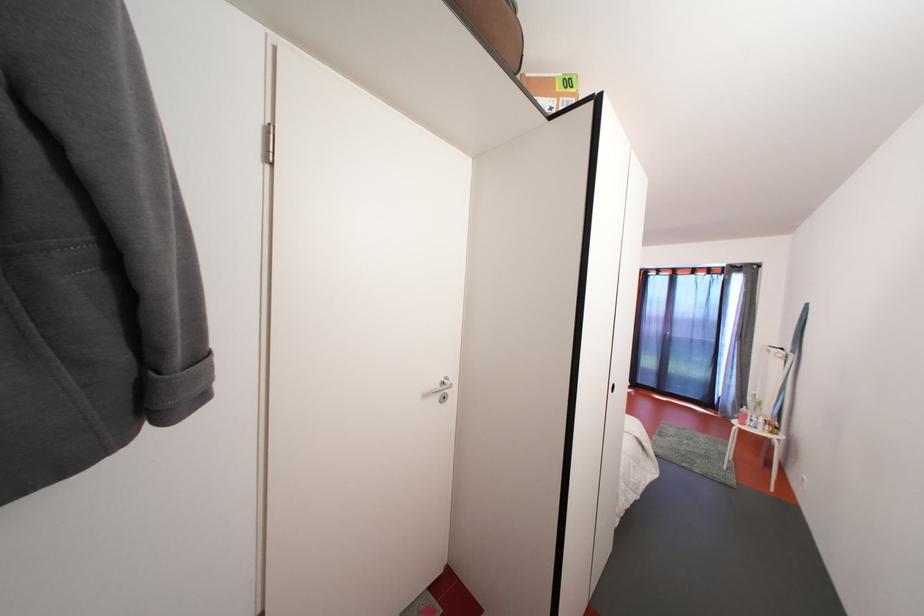
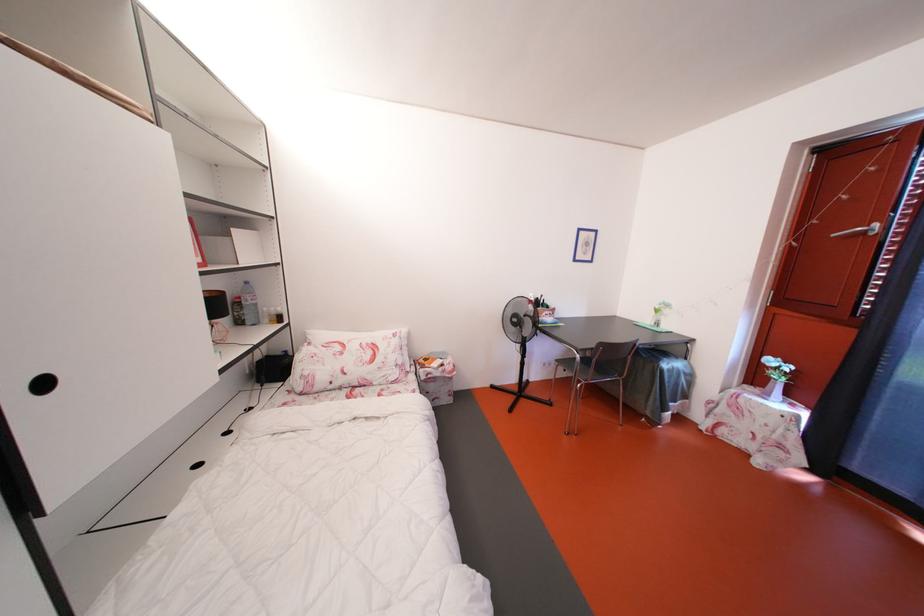
What movement of the cameraman would produce the second image?

The cameraman moved toward right, forward.